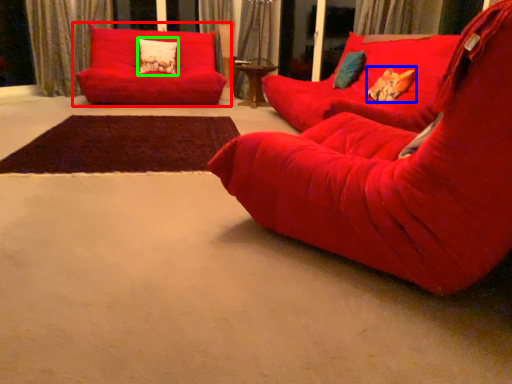
Question: Which is nearer to the studio couch (highlighted by a red box)? pillow (highlighted by a blue box) or pillow (highlighted by a green box).

Choices:
 (A) pillow
 (B) pillow

Answer: (B)